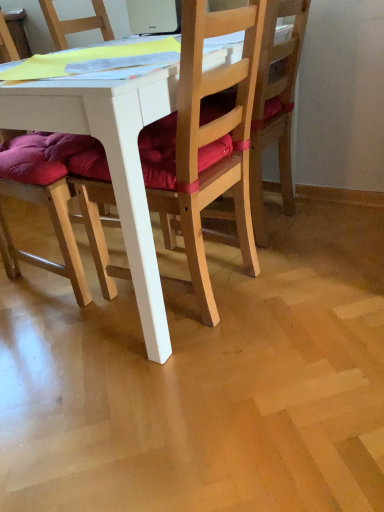
What are the coordinates of `free point in front of wooden chair at center, which is the 3th chair in left-to-right order` in the screenshot? It's located at (295, 259).